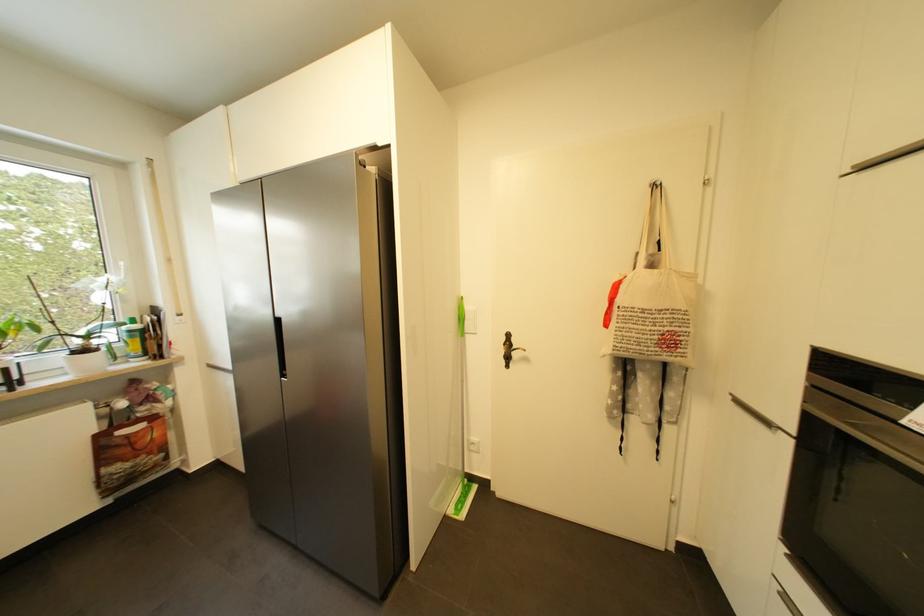
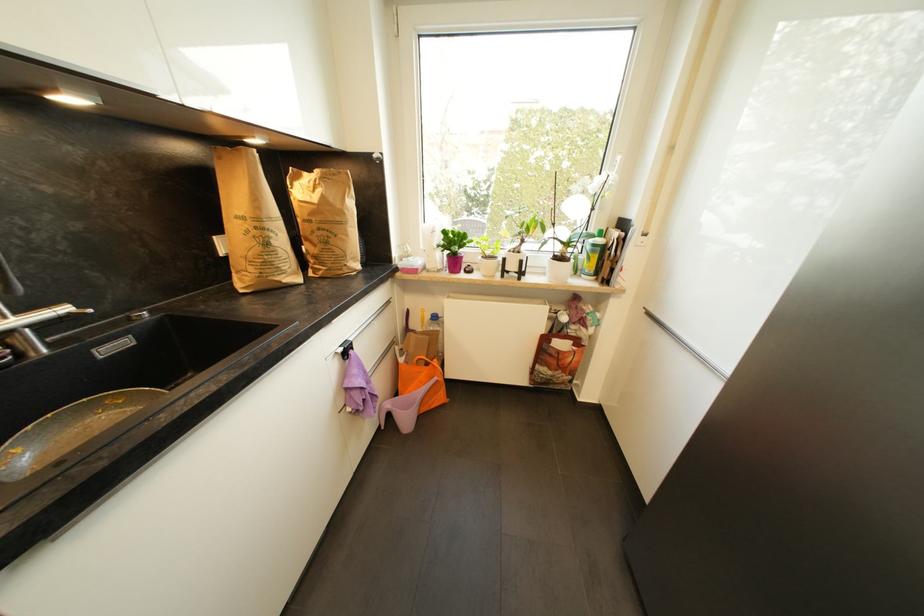
Find the pixel in the second image that matches point (135, 333) in the first image.

(599, 246)